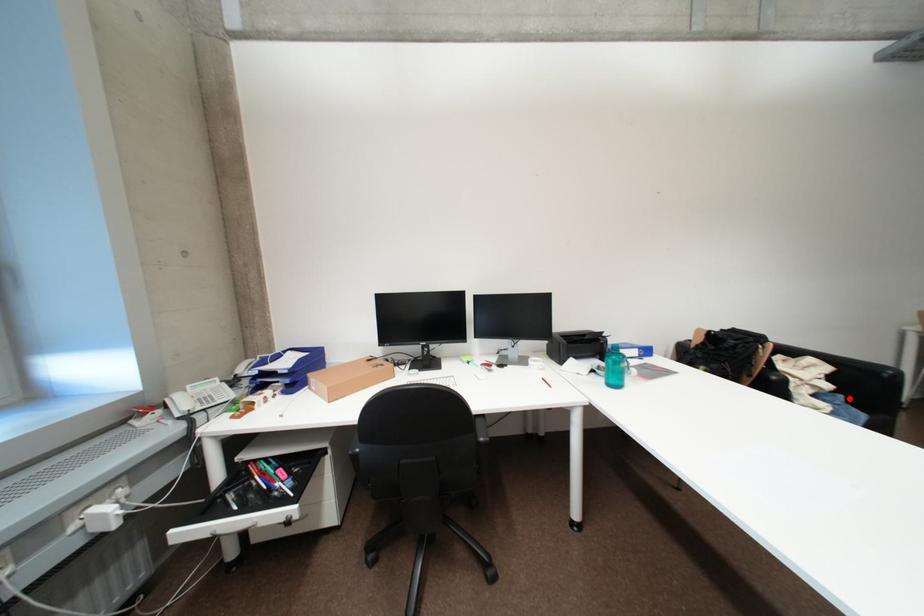
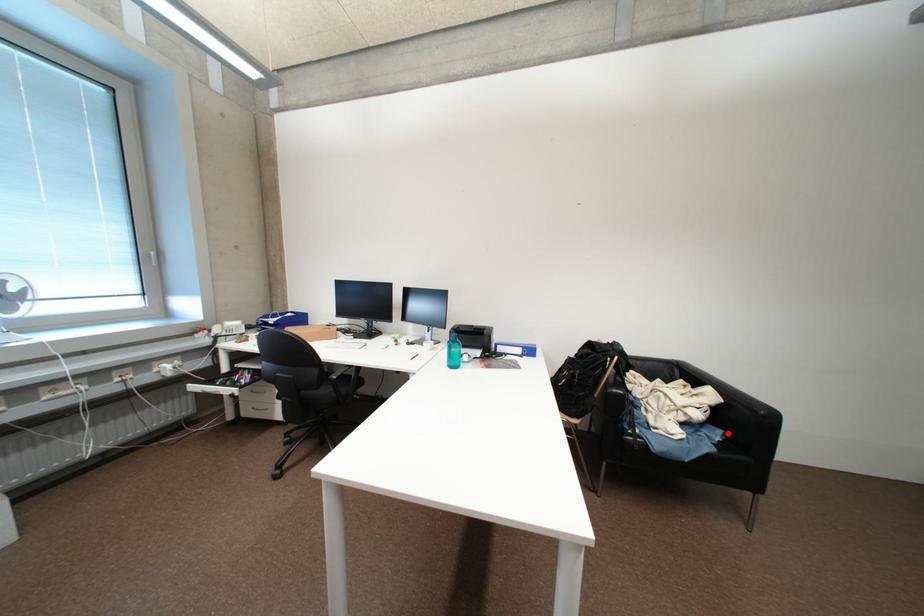
I am providing you with two images of the same scene from different viewpoints. A red point is marked on the first image and another point is marked on the second image. Are the points marked in image1 and image2 representing the same 3D position?

Yes